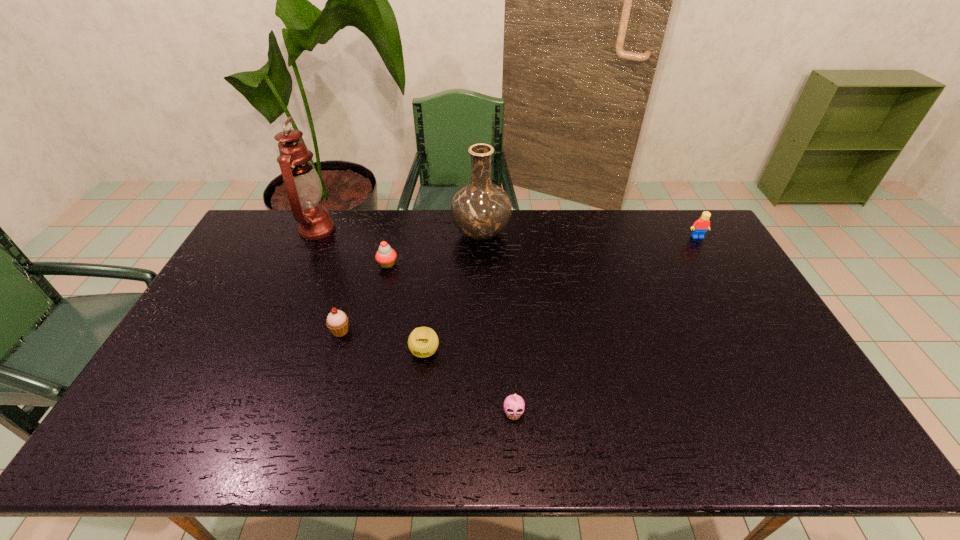
You are a GUI agent. You are given a task and a screenshot of the screen. Output one action in this format:
    pyautogui.click(x=<x>, y=<y>)
    Task: Click on the fourth object from right to left
    
    Given the screenshot: What is the action you would take?
    pyautogui.click(x=423, y=342)

Where is `the second nearest object`? the second nearest object is located at coordinates (423, 342).

Locate an element on the screen. Image resolution: width=960 pixels, height=540 pixels. vacant space located on the front of the oil lamp is located at coordinates (271, 333).

The image size is (960, 540). I want to click on free space located 0.110m on the right of the sixth shortest object, so click(540, 234).

Find the location of a particular element. vacant area situated on the face of the rightmost object is located at coordinates (709, 258).

At what (x,y) coordinates should I click in order to perform the action: click on free space located 0.290m on the front of the second cupcake from right to left. Please return your answer as a coordinate pair (x, y). This screenshot has width=960, height=540. Looking at the image, I should click on (370, 340).

Identify the location of vacant position located on the front of the second nearest cupcake. (324, 384).

The height and width of the screenshot is (540, 960). What are the coordinates of `vacant space situated on the face of the nearest cupcake` in the screenshot? It's located at (516, 443).

You are a GUI agent. You are given a task and a screenshot of the screen. Output one action in this format:
    pyautogui.click(x=<x>, y=<y>)
    Task: Click on the free space located on the logo side of the softball
    
    Given the screenshot: What is the action you would take?
    (420, 396)

Where is `oil lamp that is at the far edge`? This screenshot has width=960, height=540. oil lamp that is at the far edge is located at coordinates (304, 189).